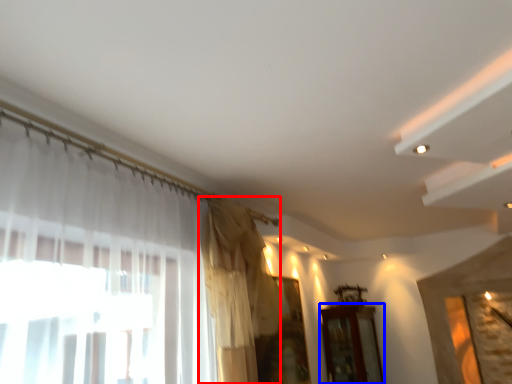
Question: Which object appears farthest to the camera in this image, curtain (highlighted by a red box) or furniture (highlighted by a blue box)?

Choices:
 (A) curtain
 (B) furniture

Answer: (B)